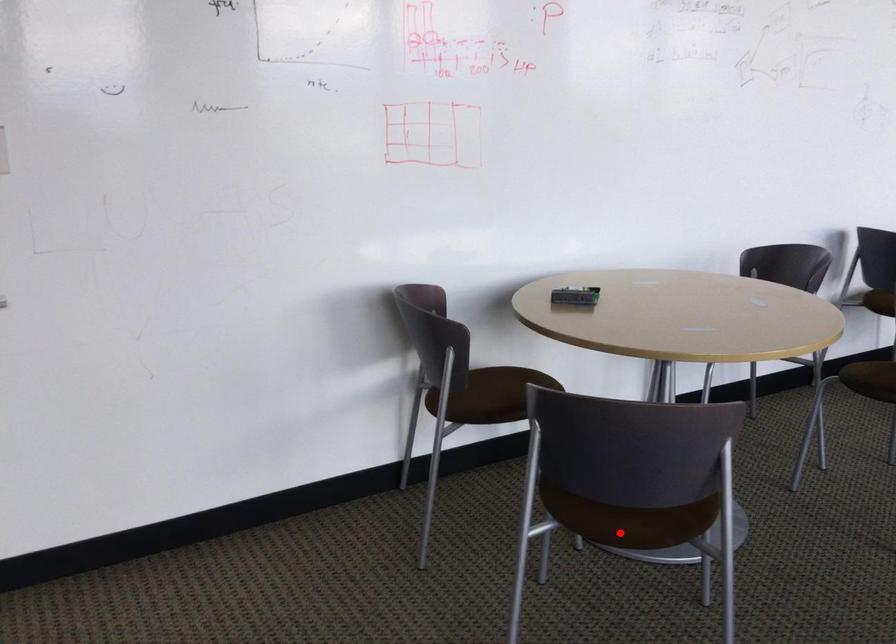
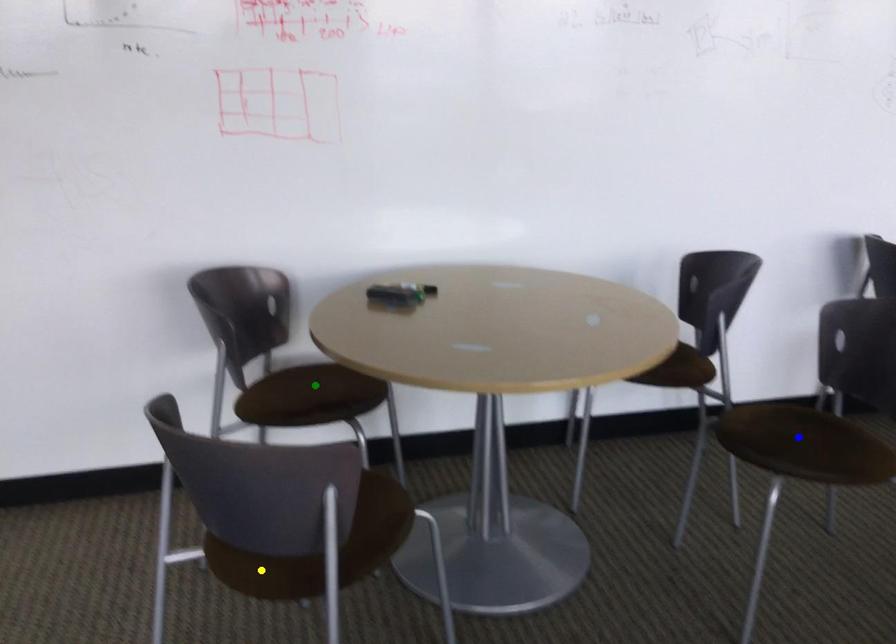
Question: I am providing you with two images of the same scene from different viewpoints. A red point is marked on the first image. You are given multiple points on the second image. Which point in image 2 represents the same 3d spot as the red point in image 1?

Choices:
 (A) green point
 (B) blue point
 (C) yellow point

Answer: (C)